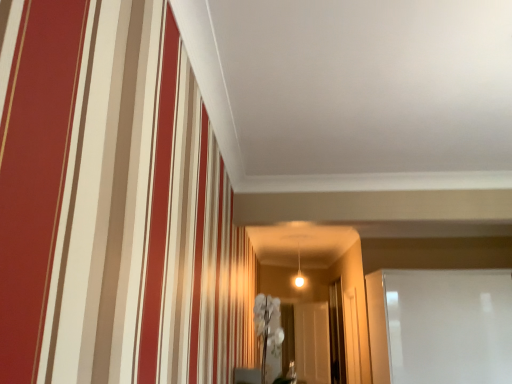
What do you see at coordinates (336, 334) in the screenshot?
I see `transparent glass door at center, the second glass door from the right` at bounding box center [336, 334].

This screenshot has height=384, width=512. Describe the element at coordinates (440, 326) in the screenshot. I see `white glossy glass door at right, which appears as the first glass door when viewed from the right` at that location.

Image resolution: width=512 pixels, height=384 pixels. What do you see at coordinates (312, 342) in the screenshot? I see `transparent glass door at center, marked as the third glass door in a front-to-back arrangement` at bounding box center [312, 342].

Where is `transparent glass door at center, placed as the second glass door when sorted from front to back`? transparent glass door at center, placed as the second glass door when sorted from front to back is located at coordinates (336, 334).

This screenshot has height=384, width=512. What are the coordinates of `the 2nd glass door positioned above the transparent glass door at center, marked as the third glass door in a front-to-back arrangement (from the image's perspective)` in the screenshot? It's located at (440, 326).

Is transparent glass door at center, which appears as the first glass door when viewed from the left, positioned with its back to white glossy glass door at right, which is counted as the third glass door, starting from the back?

No, transparent glass door at center, which appears as the first glass door when viewed from the left,'s orientation is not away from white glossy glass door at right, which is counted as the third glass door, starting from the back.

Does transparent glass door at center, marked as the third glass door in a front-to-back arrangement, have a greater width compared to white glossy glass door at right, the third glass door from the left?

No, transparent glass door at center, marked as the third glass door in a front-to-back arrangement, is not wider than white glossy glass door at right, the third glass door from the left.

From the image's perspective, is transparent glass door at center, marked as the third glass door in a front-to-back arrangement, located beneath transparent glass door at center, the 2th glass door viewed from the back?

Yes.

Can you see transparent glass door at center, which appears as the third glass door when viewed from the right, touching transparent glass door at center, the second glass door from the right?

No.

Between transparent glass door at center, which appears as the third glass door when viewed from the right, and transparent glass door at center, placed as the second glass door when sorted from front to back, which one appears on the left side from the viewer's perspective?

Positioned to the left is transparent glass door at center, which appears as the third glass door when viewed from the right.

Which is in front, point (317, 316) or point (341, 366)?

Positioned in front is point (341, 366).

Does transparent glass door at center, the 2th glass door viewed from the back, have a larger size compared to white glossy glass door at right, the first glass door when ordered from front to back?

Actually, transparent glass door at center, the 2th glass door viewed from the back, might be smaller than white glossy glass door at right, the first glass door when ordered from front to back.

Is transparent glass door at center, placed as the second glass door when sorted from front to back, situated inside white glossy glass door at right, the third glass door from the left, or outside?

transparent glass door at center, placed as the second glass door when sorted from front to back, is not inside white glossy glass door at right, the third glass door from the left, it's outside.

Considering the relative positions of transparent glass door at center, placed as the second glass door when sorted from front to back, and white glossy glass door at right, which is counted as the third glass door, starting from the back, in the image provided, is transparent glass door at center, placed as the second glass door when sorted from front to back, to the right of white glossy glass door at right, which is counted as the third glass door, starting from the back, from the viewer's perspective?

No.

Which is behind, point (345, 364) or point (384, 290)?

Positioned behind is point (345, 364).

There is a white glossy glass door at right, the third glass door from the left. Identify the location of the 1st glass door below it (from the image's perspective). (336, 334).

In terms of size, does white glossy glass door at right, the first glass door when ordered from front to back, appear bigger or smaller than transparent glass door at center, the second glass door from the right?

Considering their sizes, white glossy glass door at right, the first glass door when ordered from front to back, takes up more space than transparent glass door at center, the second glass door from the right.

Which point is more forward, [389,296] or [336,289]?

Point [389,296]

Is transparent glass door at center, the second glass door from the right, at the back of white glossy glass door at right, the third glass door from the left?

Yes, white glossy glass door at right, the third glass door from the left,'s orientation is away from transparent glass door at center, the second glass door from the right.

Which is more to the left, transparent glass door at center, the 2th glass door viewed from the back, or transparent glass door at center, which is the 1th glass door in back-to-front order?

transparent glass door at center, which is the 1th glass door in back-to-front order.

Considering the positions of objects transparent glass door at center, which appears as the second glass door when viewed from the left, and transparent glass door at center, which appears as the third glass door when viewed from the right, in the image provided, who is behind, transparent glass door at center, which appears as the second glass door when viewed from the left, or transparent glass door at center, which appears as the third glass door when viewed from the right,?

transparent glass door at center, which appears as the third glass door when viewed from the right, is further away from the camera.

From the picture: Is transparent glass door at center, the 2th glass door viewed from the back, wider or thinner than transparent glass door at center, which appears as the third glass door when viewed from the right?

Considering their sizes, transparent glass door at center, the 2th glass door viewed from the back, looks slimmer than transparent glass door at center, which appears as the third glass door when viewed from the right.

Is transparent glass door at center, placed as the second glass door when sorted from front to back, surrounding transparent glass door at center, which appears as the first glass door when viewed from the left?

No.

Is white glossy glass door at right, which is counted as the third glass door, starting from the back, next to transparent glass door at center, which appears as the first glass door when viewed from the left?

No, white glossy glass door at right, which is counted as the third glass door, starting from the back, is not touching transparent glass door at center, which appears as the first glass door when viewed from the left.

Consider the image. Can you tell me how much white glossy glass door at right, which appears as the first glass door when viewed from the right, and transparent glass door at center, which appears as the third glass door when viewed from the right, differ in facing direction?

The angle between the facing direction of white glossy glass door at right, which appears as the first glass door when viewed from the right, and the facing direction of transparent glass door at center, which appears as the third glass door when viewed from the right, is 56.4 degrees.

Which is behind, point (413, 348) or point (322, 330)?

The point (322, 330) is farther.

Is white glossy glass door at right, which appears as the first glass door when viewed from the right, situated inside transparent glass door at center, which appears as the first glass door when viewed from the left, or outside?

white glossy glass door at right, which appears as the first glass door when viewed from the right, exists outside the volume of transparent glass door at center, which appears as the first glass door when viewed from the left.

From a real-world perspective, starting from the transparent glass door at center, marked as the third glass door in a front-to-back arrangement, which glass door is the 2nd one vertically above it? Please provide its 2D coordinates.

[(440, 326)]

Find the location of a particular element. Image resolution: width=512 pixels, height=384 pixels. glass door below the transparent glass door at center, which appears as the second glass door when viewed from the left (from a real-world perspective) is located at coordinates tap(312, 342).

Looking at the image, which one is located further to white glossy glass door at right, which appears as the first glass door when viewed from the right, transparent glass door at center, which appears as the first glass door when viewed from the left, or transparent glass door at center, placed as the second glass door when sorted from front to back?

Based on the image, transparent glass door at center, which appears as the first glass door when viewed from the left, appears to be further to white glossy glass door at right, which appears as the first glass door when viewed from the right.

From the image, which object appears to be nearer to transparent glass door at center, which appears as the third glass door when viewed from the right, transparent glass door at center, the 2th glass door viewed from the back, or white glossy glass door at right, which appears as the first glass door when viewed from the right?

The object closer to transparent glass door at center, which appears as the third glass door when viewed from the right, is transparent glass door at center, the 2th glass door viewed from the back.

Considering their positions, is transparent glass door at center, placed as the second glass door when sorted from front to back, positioned closer to white glossy glass door at right, the third glass door from the left, than transparent glass door at center, marked as the third glass door in a front-to-back arrangement?

Based on the image, transparent glass door at center, placed as the second glass door when sorted from front to back, appears to be nearer to white glossy glass door at right, the third glass door from the left.

From the image, which object appears to be nearer to transparent glass door at center, marked as the third glass door in a front-to-back arrangement, white glossy glass door at right, the first glass door when ordered from front to back, or transparent glass door at center, the second glass door from the right?

transparent glass door at center, the second glass door from the right, is closer to transparent glass door at center, marked as the third glass door in a front-to-back arrangement.

From the image, which object appears to be nearer to transparent glass door at center, the second glass door from the right, transparent glass door at center, which appears as the first glass door when viewed from the left, or white glossy glass door at right, which appears as the first glass door when viewed from the right?

transparent glass door at center, which appears as the first glass door when viewed from the left, is closer to transparent glass door at center, the second glass door from the right.

Considering their positions, is white glossy glass door at right, which is counted as the third glass door, starting from the back, positioned closer to transparent glass door at center, which appears as the second glass door when viewed from the left, than transparent glass door at center, which appears as the third glass door when viewed from the right?

transparent glass door at center, which appears as the third glass door when viewed from the right, lies closer to transparent glass door at center, which appears as the second glass door when viewed from the left, than the other object.

You are a GUI agent. You are given a task and a screenshot of the screen. Output one action in this format:
    pyautogui.click(x=<x>, y=<y>)
    Task: Click on the glass door positioned between white glossy glass door at right, the first glass door when ordered from front to back, and transparent glass door at center, which appears as the third glass door when viewed from the right, from near to far
    
    Given the screenshot: What is the action you would take?
    pyautogui.click(x=336, y=334)